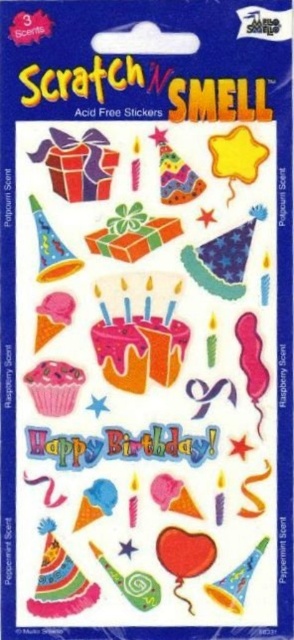
Does pink glossy cupcake at center-left appear on the left side of matte pink cupcake at lower left?

In fact, pink glossy cupcake at center-left is to the right of matte pink cupcake at lower left.

In the scene shown: Does pink glossy cupcake at center-left appear under matte pink cupcake at lower left?

Indeed, pink glossy cupcake at center-left is positioned under matte pink cupcake at lower left.

This screenshot has height=640, width=294. I want to click on pink glossy cupcake at center-left, so click(54, 387).